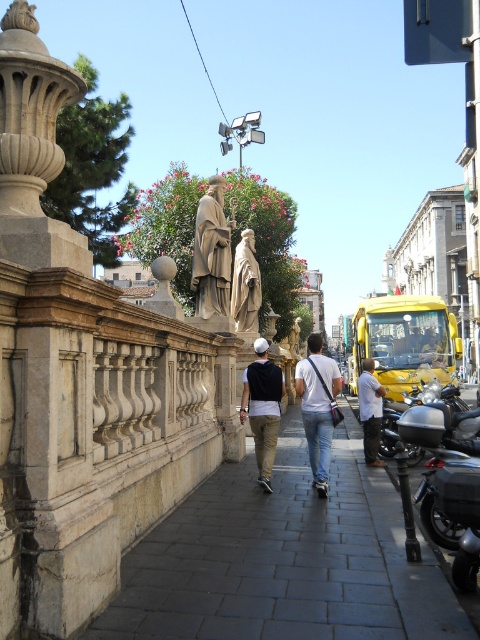
Question: Which of the following is the closest to the observer?

Choices:
 (A) matte black cap at center
 (B) white cotton shirt at right
 (C) matte stone statue at center
 (D) golden polished statue at center

Answer: (A)

Question: Does gray stone pavement at center have a smaller size compared to white cotton shirt at right?

Choices:
 (A) no
 (B) yes

Answer: (A)

Question: Is polished bronze statue at center further to the viewer compared to golden polished statue at center?

Choices:
 (A) yes
 (B) no

Answer: (B)

Question: Which object is the farthest from the white cotton shirt at right?

Choices:
 (A) polished bronze statue at center
 (B) gray stone pavement at center

Answer: (A)

Question: Can you confirm if gray stone pavement at center is positioned above polished bronze statue at center?

Choices:
 (A) yes
 (B) no

Answer: (B)

Question: Which object is the closest to the gray stone pavement at center?

Choices:
 (A) golden polished statue at center
 (B) white cotton shirt at right

Answer: (B)